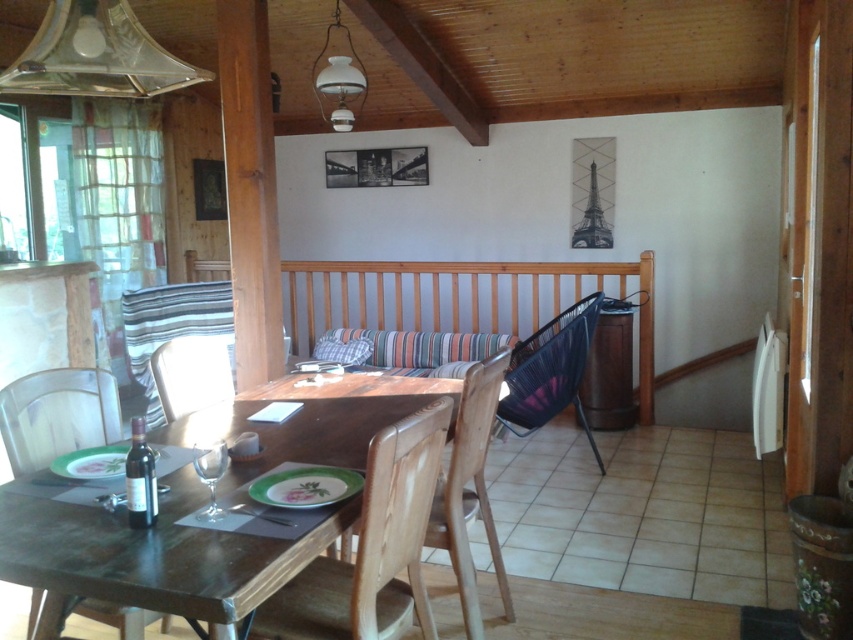
Question: Which object is closer to the camera taking this photo?

Choices:
 (A) white fabric chair at center
 (B) wooden chair at lower left
 (C) black mesh chair at center
 (D) wooden table at center

Answer: (D)

Question: Is wooden pillar at center further to camera compared to black mesh chair at center?

Choices:
 (A) yes
 (B) no

Answer: (B)

Question: Is wooden chair at lower left positioned behind black mesh chair at center?

Choices:
 (A) no
 (B) yes

Answer: (A)

Question: Which object appears farthest from the camera in this image?

Choices:
 (A) black mesh chair at center
 (B) white fabric chair at center
 (C) wooden table at center

Answer: (A)

Question: Can you confirm if wooden chair at lower left is smaller than black mesh chair at center?

Choices:
 (A) yes
 (B) no

Answer: (A)

Question: Which of the following is the farthest from the observer?

Choices:
 (A) (79, 403)
 (B) (141, 588)
 (C) (235, 28)

Answer: (C)